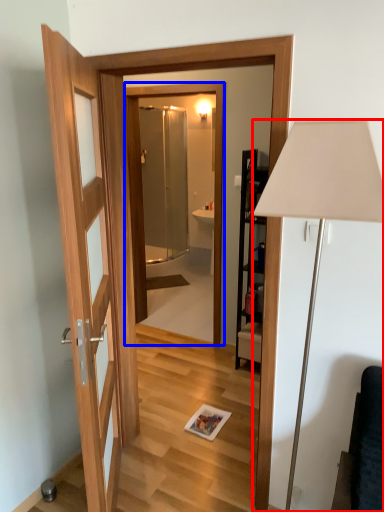
Question: Which of the following is the closest to the observer, lamp (highlighted by a red box) or mirror (highlighted by a blue box)?

Choices:
 (A) lamp
 (B) mirror

Answer: (A)